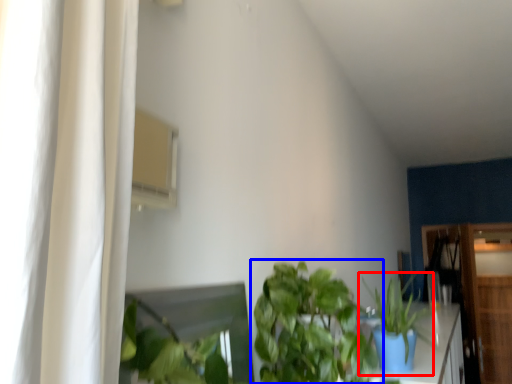
Question: Among these objects, which one is farthest to the camera, houseplant (highlighted by a red box) or houseplant (highlighted by a blue box)?

Choices:
 (A) houseplant
 (B) houseplant

Answer: (A)